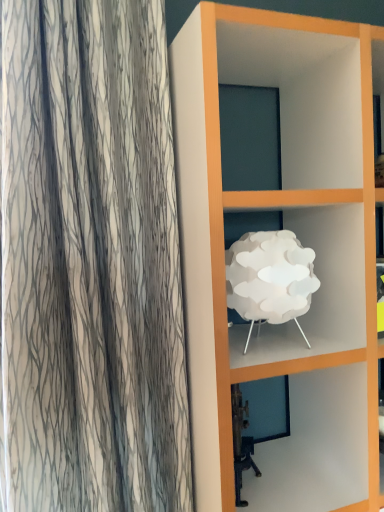
Identify the location of white paper-like at center. (270, 278).

Measure the distance between point [311,285] and camera.

1.06 meters.

What is the approximate width of white paper-like at center?

white paper-like at center is 9.57 inches in width.

This screenshot has height=512, width=384. Describe the element at coordinates (270, 278) in the screenshot. I see `white paper-like at center` at that location.

In order to face white paper-like at center, should I rotate leftwards or rightwards?

Rotate your view right by about 10.400°.

Find the location of a particular element. The width and height of the screenshot is (384, 512). white paper-like at center is located at coordinates (270, 278).